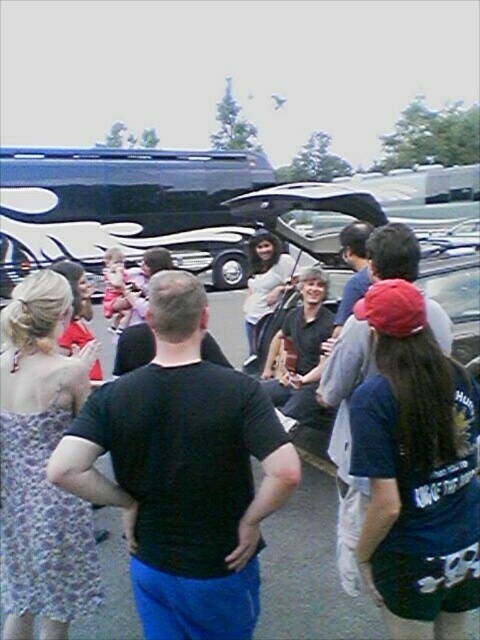
You are a photographer trying to capture a candid shot of the two people at the center of the gathering. The black matte shirt at center and the dark blue fabric shirt at center are both in your frame. Based on their positions, which one is more likely to be in focus if you focus on the person closer to the camera?

The black matte shirt at center is closer to the viewer than the dark blue fabric shirt at center, so focusing on the person closer to the camera would put the black matte shirt at center in focus while the dark blue fabric shirt at center may be slightly out of focus.

You are a photographer at the event and want to take a photo of both the black matte shirt at center and the dark blue fabric shirt at center. Which shirt should you focus on first if you want to ensure both are in frame without moving the camera?

You should focus on the black matte shirt at center first because it is shorter than the dark blue fabric shirt at center, so adjusting the camera to include the taller shirt will naturally include the shorter one as well.

You are at the gathering and want to greet the person wearing the black matte shirt at center. Which direction should you move relative to the dark blue fabric shirt at center?

The black matte shirt at center is to the left of the dark blue fabric shirt at center, so you should move to the left of the dark blue fabric shirt at center to greet them.